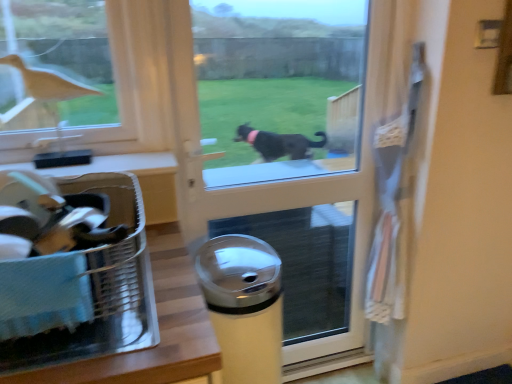
Question: Considering the positions of translucent plastic laundry basket at lower left and matte brown bird at upper left in the image, is translucent plastic laundry basket at lower left taller or shorter than matte brown bird at upper left?

Choices:
 (A) tall
 (B) short

Answer: (B)

Question: Looking at the image, does translucent plastic laundry basket at lower left seem bigger or smaller compared to matte brown bird at upper left?

Choices:
 (A) big
 (B) small

Answer: (A)

Question: Estimate the real-world distances between objects in this image. Which object is closer to the matte brown bird at upper left?

Choices:
 (A) transparent glass screen door at center
 (B) translucent plastic laundry basket at lower left
 (C) metallic silver trash can at center

Answer: (B)

Question: Which object is the closest to the transparent glass screen door at center?

Choices:
 (A) metallic silver trash can at center
 (B) translucent plastic laundry basket at lower left
 (C) matte brown bird at upper left

Answer: (A)